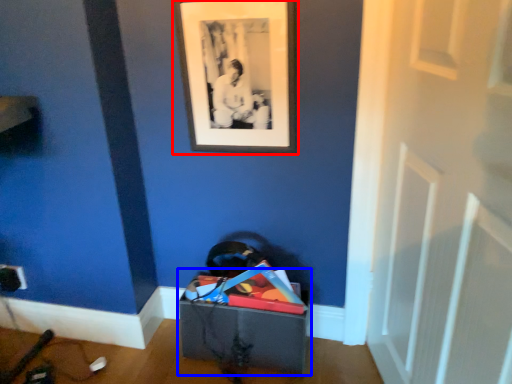
Question: Among these objects, which one is nearest to the camera, picture frame (highlighted by a red box) or storage box (highlighted by a blue box)?

Choices:
 (A) picture frame
 (B) storage box

Answer: (A)